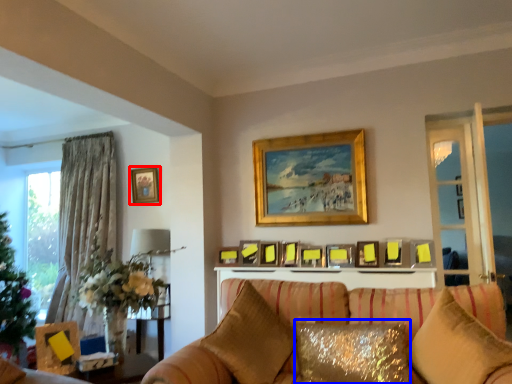
Question: Which object is further to the camera taking this photo, picture frame (highlighted by a red box) or pillow (highlighted by a blue box)?

Choices:
 (A) picture frame
 (B) pillow

Answer: (A)